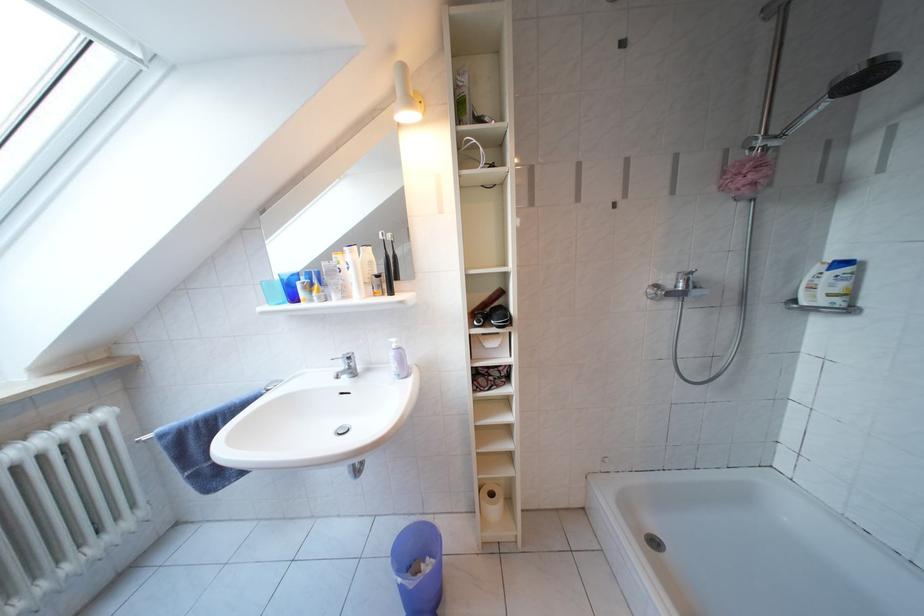
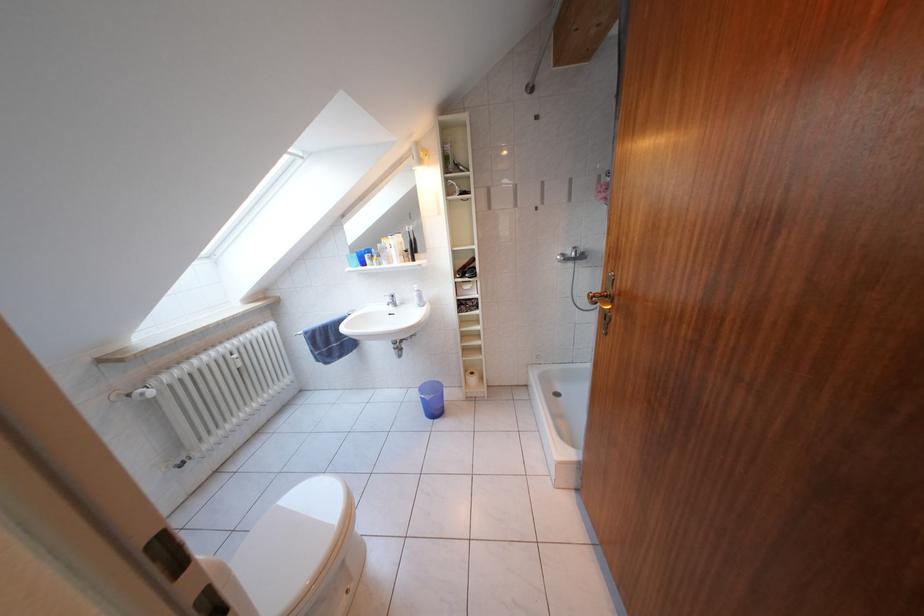
Question: The first image is from the beginning of the video and the second image is from the end. How did the camera likely rotate when shooting the video?

Choices:
 (A) Left
 (B) Right
 (C) Up
 (D) Down

Answer: (D)